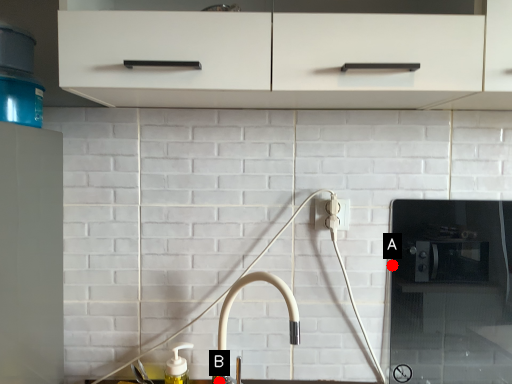
Question: Two points are circled on the image, labeled by A and B beside each circle. Which point is closer to the camera taking this photo?

Choices:
 (A) A is closer
 (B) B is closer

Answer: (A)